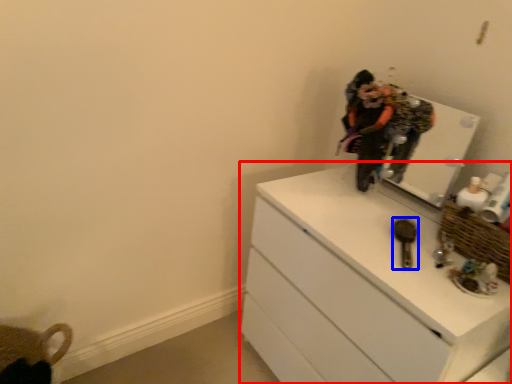
Question: Which point is closer to the camera, chest of drawers (highlighted by a red box) or brush (highlighted by a blue box)?

Choices:
 (A) chest of drawers
 (B) brush

Answer: (A)